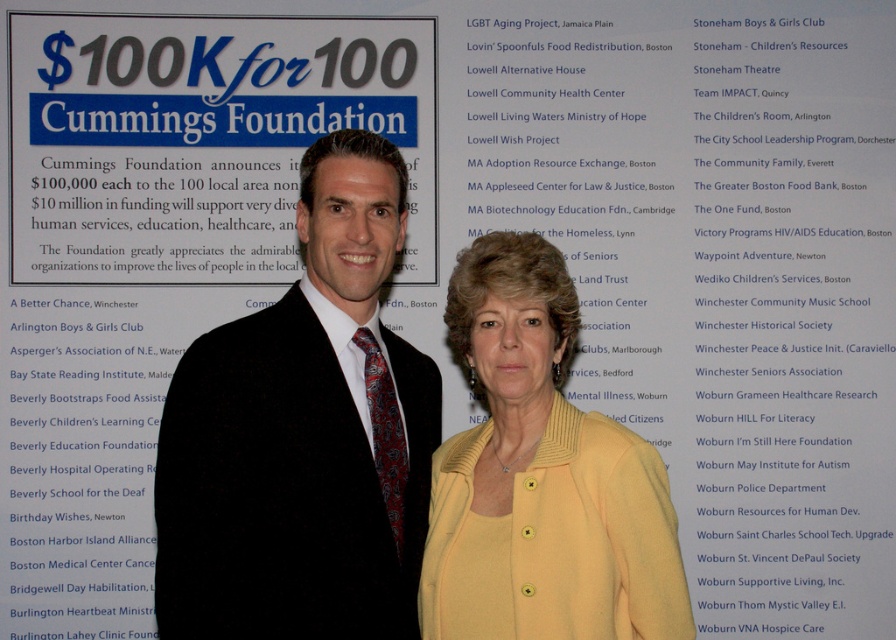
You are a photographer setting up for a group photo. You need to ensure that both the black velvet suit at center and the yellow matte cardigan at center are fully visible in the frame. Based on their positions and sizes, which clothing item might require more space to the left or right to avoid being cut off?

The black velvet suit at center might be wider than the yellow matte cardigan at center, so it would require more space to the left or right to avoid being cut off.

What is the location of the point at coordinates (303, 435) in the image?

The point at coordinates (303, 435) is located on the black velvet suit at center.

You are a photographer standing 3 meters away from the black velvet suit at center. Can you capture the entire scene in one photo without moving closer?

The distance between the black velvet suit at center and the viewer is 2.84 meters. Since you are standing 3 meters away, you are slightly farther than the required distance. To capture the entire scene without moving closer, you might need a wider lens or adjust your camera settings to ensure the entire scene fits within the frame.